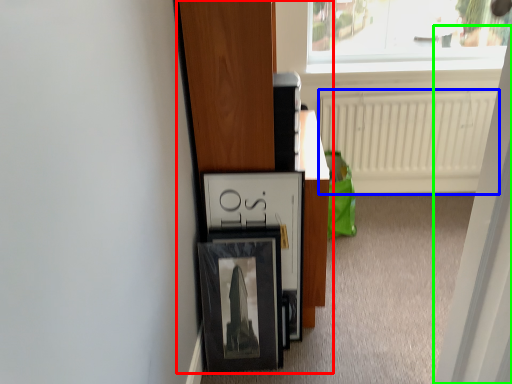
Question: Estimate the real-world distances between objects in this image. Which object is farther from furniture (highlighted by a red box), radiator (highlighted by a blue box) or screen door (highlighted by a green box)?

Choices:
 (A) radiator
 (B) screen door

Answer: (A)